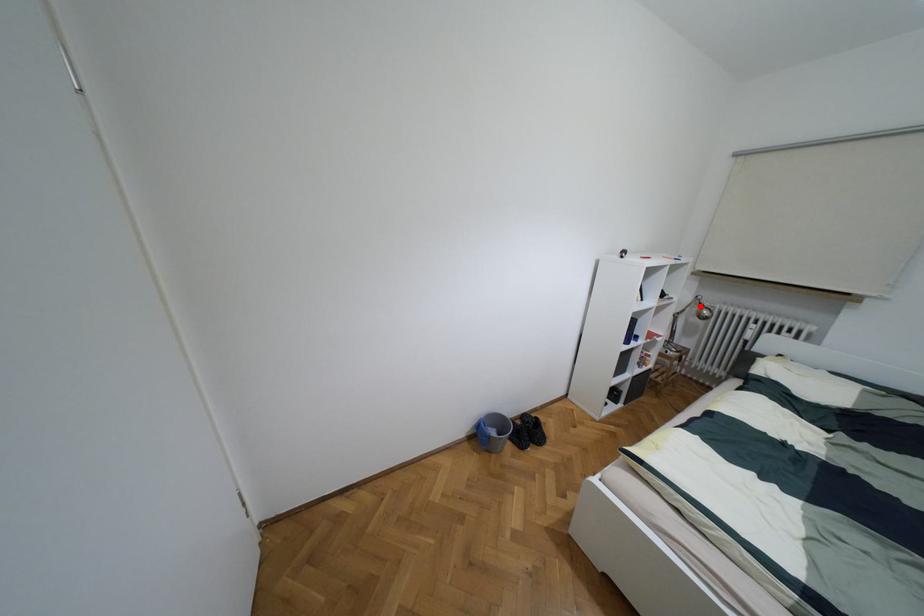
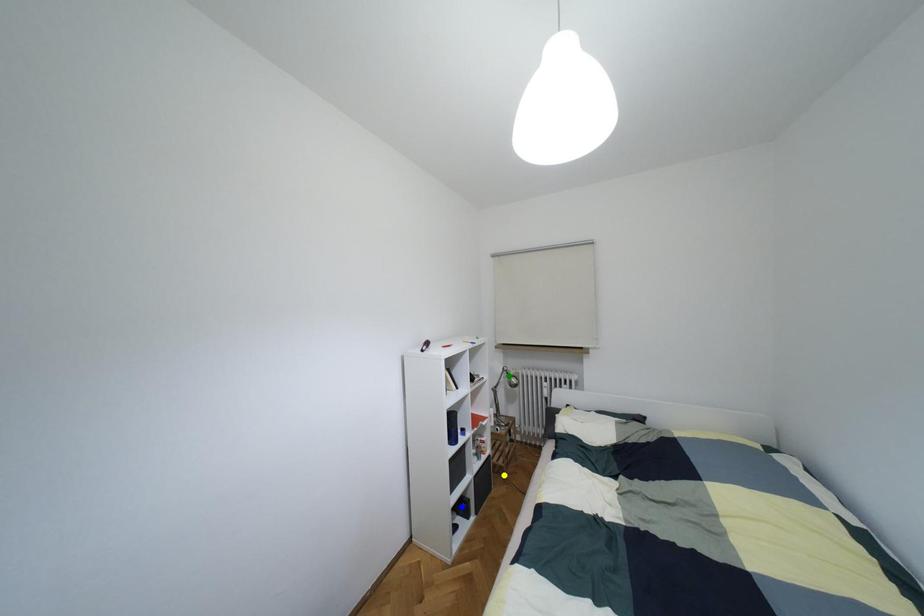
Question: I am providing you with two images of the same scene from different viewpoints. A red point is marked on the first image. You are given multiple points on the second image. Which mark in image 2 goes with the point in image 1?

Choices:
 (A) yellow point
 (B) green point
 (C) blue point

Answer: (B)